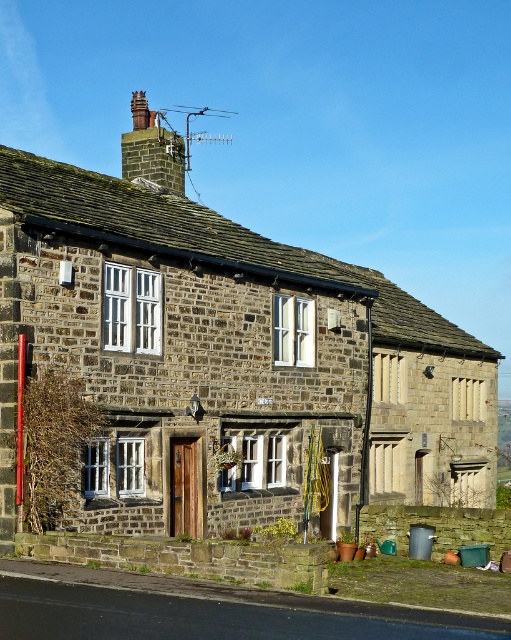
You are standing in front of the stone cottage at center and want to place a new satellite dish on the roof. The satellite dish needs to be installed behind the rusty metal chimney at upper center. Is this possible given their positions?

The stone cottage at center is in front of the rusty metal chimney at upper center, so the satellite dish can be placed behind the rusty metal chimney at upper center as it is already positioned behind the cottage.

You are standing in a field and see the stone cottage at center in the distance. If you want to reach the cottage within 10 minutes, what is the minimum average walking speed you need to maintain?

The distance between you and the stone cottage at center is 20.47 meters. To reach it in 10 minutes, you need to walk at a minimum average speed of approximately 0.20 meters per second.

You are a painter planning to paint the stone cottage at center and the rusty metal chimney at upper center. You need to know which object is shorter to decide where to place your ladder first. Can you tell me which one is shorter?

The stone cottage at center is not as tall as the rusty metal chimney at upper center, so the stone cottage at center is shorter. Therefore, you should place your ladder near the stone cottage at center first.